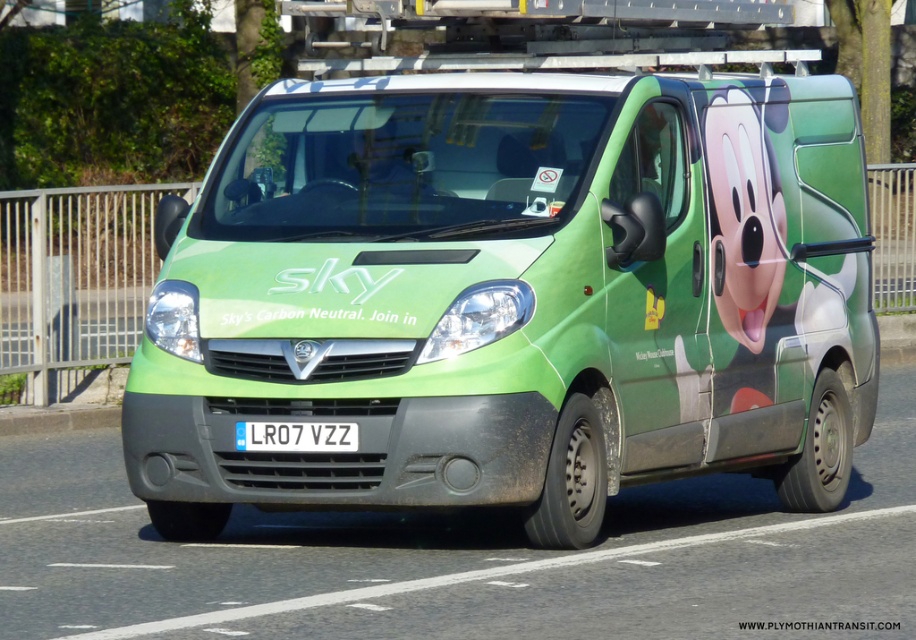
You are a delivery person who needs to attach a package to the green matte van at center. The package requires a minimum of 5 feet of space to be safely attached. Can you attach the package to the van without moving the white plastic license plate at center?

The green matte van at center is only 4.60 feet from the white plastic license plate at center. Since the required space is 5 feet, the package cannot be safely attached without moving the license plate.

You are a photographer standing at a safe distance from the road. You want to capture the green matte van at center in your photo. If your camera has a maximum focus range of 10 meters, will you be able to clearly capture the van?

The green matte van at center is 10.49 meters away from the camera. Since the maximum focus range is 10 meters, the van is slightly out of the camera range and might not be captured clearly.

You are a technician standing in front of the Sky van. You need to reach a point on the van that is closer to you. Which point should you choose between point (240, 417) and point (347, 426)?

Point (240, 417) is closer to you because it is further to the viewer than point (347, 426).